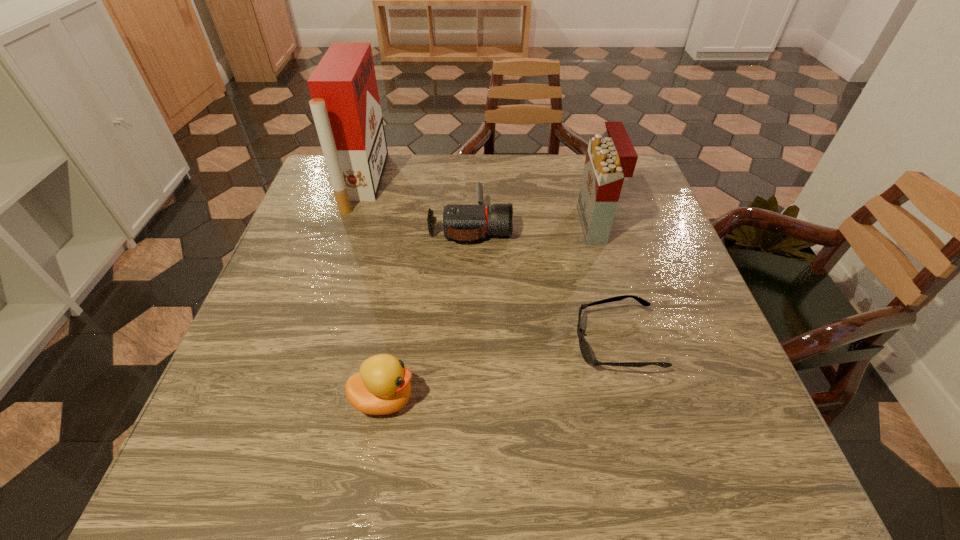
Locate an element on the screen. cigarette case that is at the right edge is located at coordinates (609, 160).

Where is `sunglasses present at the right edge`? The image size is (960, 540). sunglasses present at the right edge is located at coordinates (584, 348).

You are a GUI agent. You are given a task and a screenshot of the screen. Output one action in this format:
    pyautogui.click(x=<x>, y=<y>)
    Task: Click on the object present at the far left corner
    
    Given the screenshot: What is the action you would take?
    pyautogui.click(x=345, y=104)

In the image, there is a desktop. Identify the location of vacant space at the far edge. (462, 172).

In the image, there is a desktop. Where is `vacant space at the near edge`? vacant space at the near edge is located at coordinates (375, 490).

The height and width of the screenshot is (540, 960). I want to click on free space at the left edge of the desktop, so click(292, 251).

At what (x,y) coordinates should I click in order to perform the action: click on free spot at the right edge of the desktop. Please return your answer as a coordinate pair (x, y). This screenshot has width=960, height=540. Looking at the image, I should click on (624, 245).

At what (x,y) coordinates should I click in order to perform the action: click on vacant space at the far right corner of the desktop. Please return your answer as a coordinate pair (x, y). Looking at the image, I should click on (648, 188).

Find the location of a particular element. The image size is (960, 540). vacant space in between the fourth shortest object and the third shortest object is located at coordinates (489, 312).

The image size is (960, 540). Identify the location of free area in between the camcorder and the taller cigarette case. (417, 204).